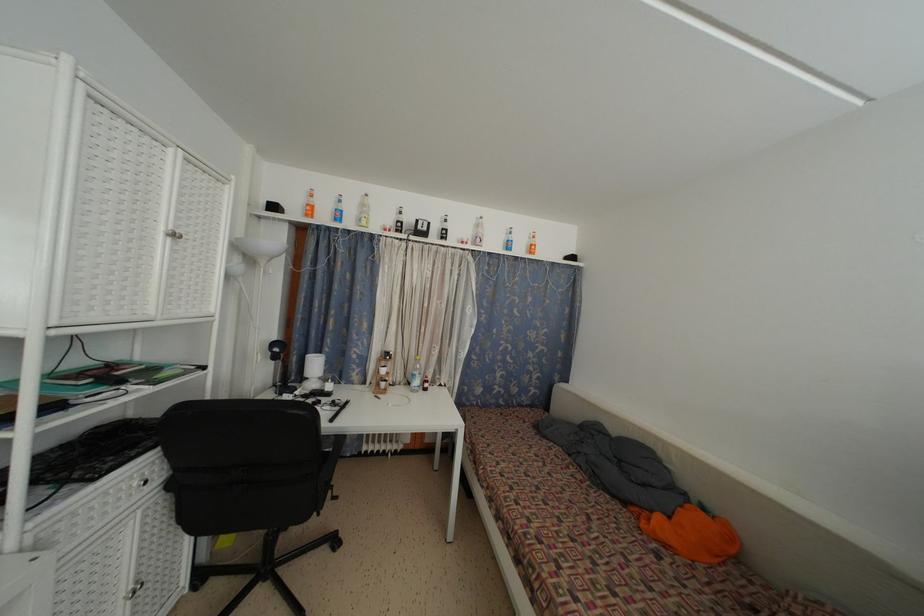
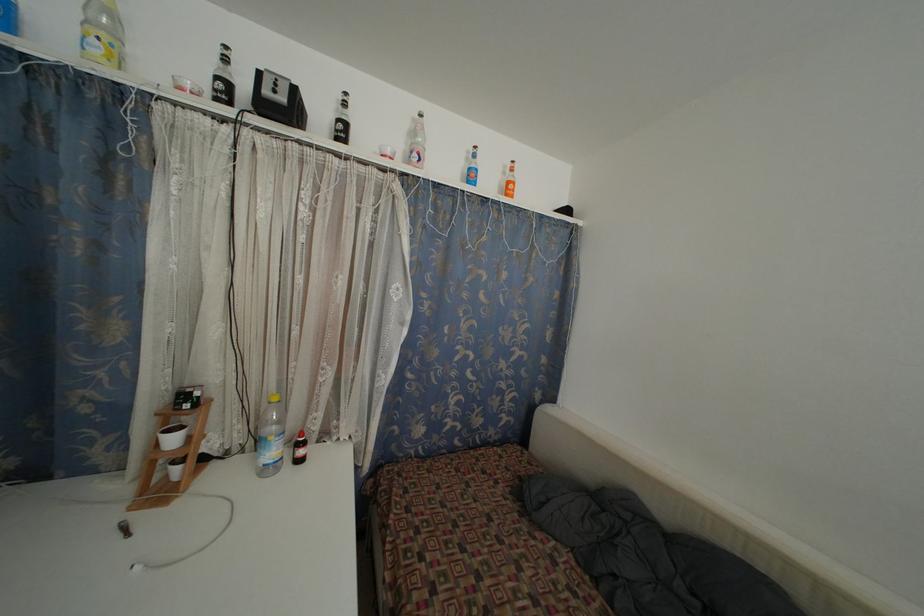
Find the pixel in the second image that matches [431,391] in the first image.

(305, 458)